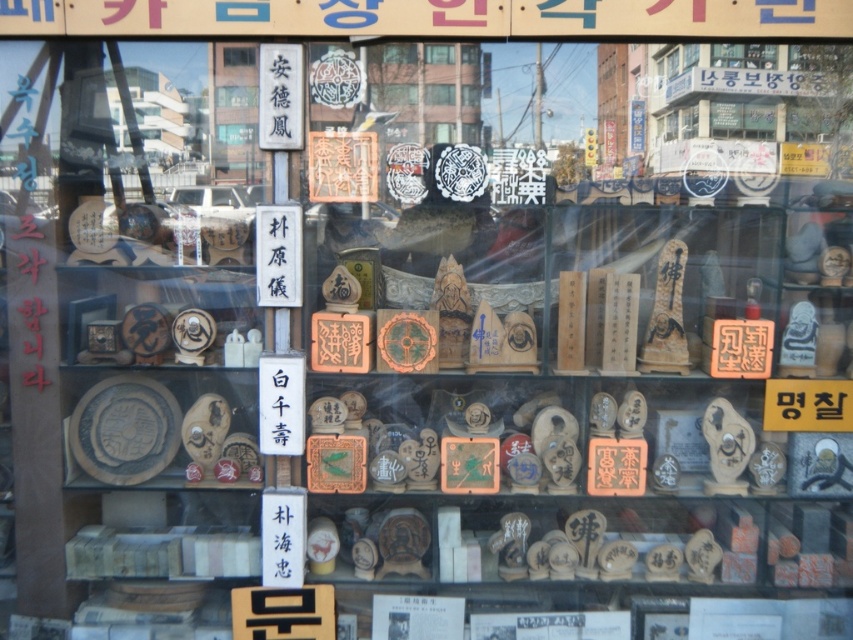
Question: Can you confirm if transparent glass window at center is positioned below wooden plaque at center?

Choices:
 (A) yes
 (B) no

Answer: (A)

Question: Which of the following is the closest to the observer?

Choices:
 (A) transparent glass window at center
 (B) wooden plaque at center

Answer: (A)

Question: Considering the relative positions of transparent glass window at center and wooden plaque at center in the image provided, where is transparent glass window at center located with respect to wooden plaque at center?

Choices:
 (A) below
 (B) above

Answer: (A)

Question: Is transparent glass window at center positioned in front of wooden plaque at center?

Choices:
 (A) no
 (B) yes

Answer: (B)